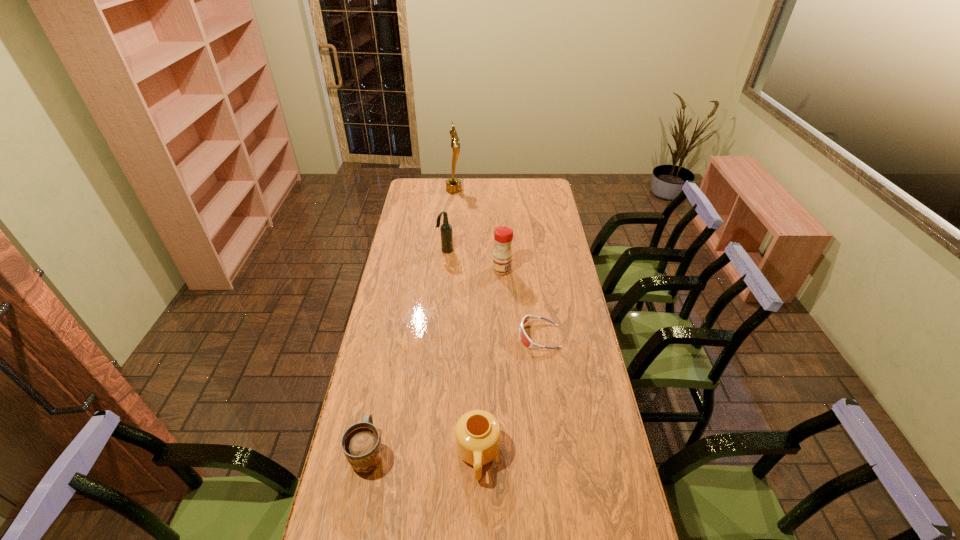
The width and height of the screenshot is (960, 540). Identify the location of the tallest object. (453, 185).

The height and width of the screenshot is (540, 960). I want to click on the farthest object, so 453,185.

Locate an element on the screen. The image size is (960, 540). the fourth nearest object is located at coordinates (502, 255).

You are a GUI agent. You are given a task and a screenshot of the screen. Output one action in this format:
    pyautogui.click(x=<x>, y=<y>)
    Task: Click on the second farthest object
    The image size is (960, 540).
    Given the screenshot: What is the action you would take?
    pyautogui.click(x=446, y=232)

Find the location of a particular element. the right mug is located at coordinates (477, 432).

This screenshot has width=960, height=540. I want to click on the left mug, so click(x=361, y=444).

I want to click on the shortest object, so click(524, 338).

Where is `the rightmost object`? This screenshot has width=960, height=540. the rightmost object is located at coordinates (524, 338).

Where is `free space located 0.090m on the front-facing side of the tallest object`? This screenshot has width=960, height=540. free space located 0.090m on the front-facing side of the tallest object is located at coordinates (477, 190).

Locate an element on the screen. Image resolution: width=960 pixels, height=540 pixels. vacant space located on the left of the condiment is located at coordinates (444, 269).